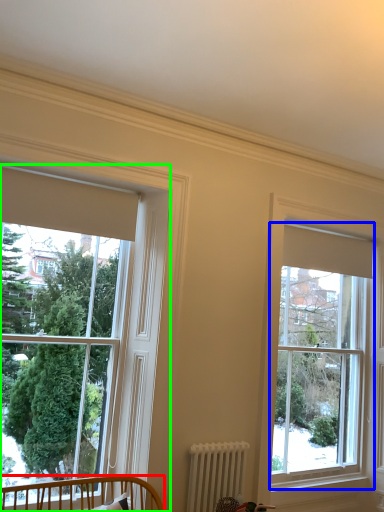
Question: Based on their relative distances, which object is nearer to furniture (highlighted by a red box)? Choose from window (highlighted by a blue box) and window (highlighted by a green box).

Choices:
 (A) window
 (B) window

Answer: (B)